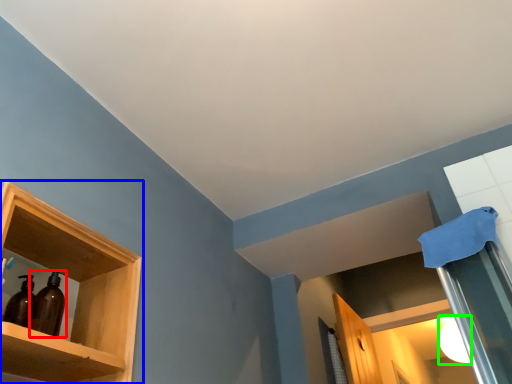
Question: Considering the real-world distances, which object is closest to bottle (highlighted by a red box)? shelf (highlighted by a blue box) or lighting (highlighted by a green box).

Choices:
 (A) shelf
 (B) lighting

Answer: (A)